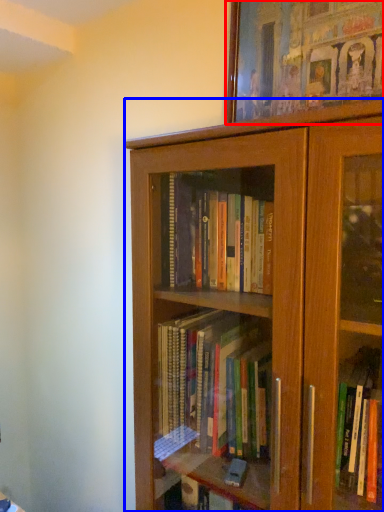
Question: Among these objects, which one is nearest to the camera, picture frame (highlighted by a red box) or bookcase (highlighted by a blue box)?

Choices:
 (A) picture frame
 (B) bookcase

Answer: (B)